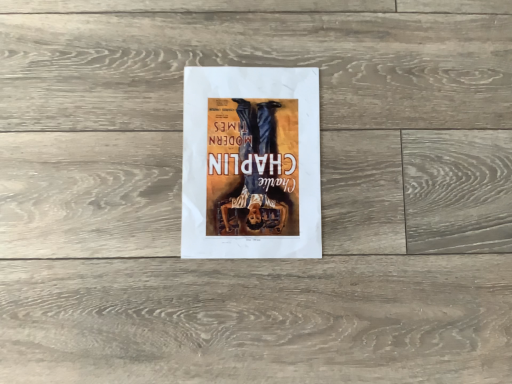
The image size is (512, 384). What do you see at coordinates (251, 163) in the screenshot?
I see `matte paper poster at center` at bounding box center [251, 163].

Where is `matte paper poster at center`? The height and width of the screenshot is (384, 512). matte paper poster at center is located at coordinates (251, 163).

Find the location of `matte paper poster at center`. matte paper poster at center is located at coordinates (251, 163).